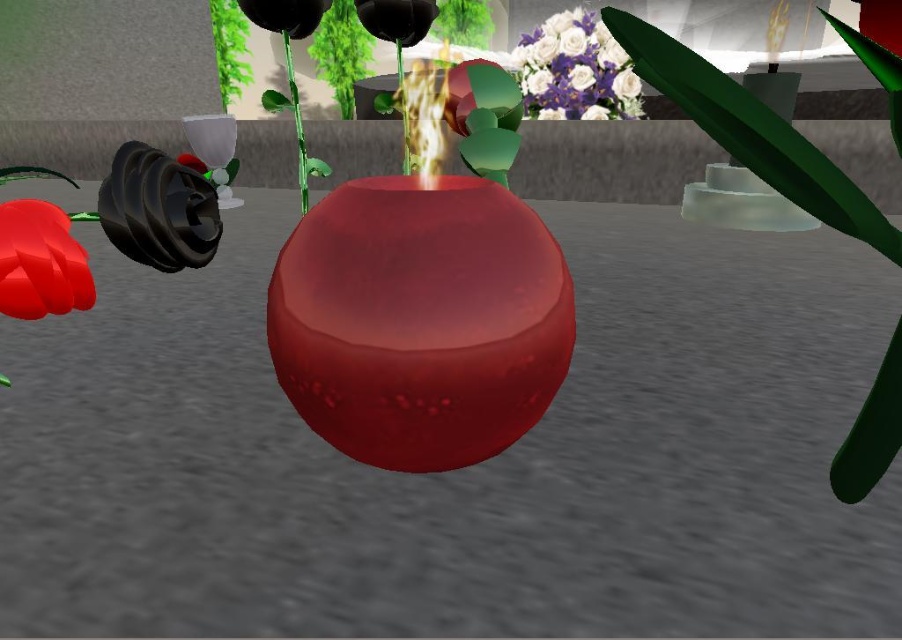
Which is behind, point (537, 102) or point (48, 202)?

Positioned behind is point (537, 102).

Is glossy ceramic vase at upper center to the right of matte red flower at lower left from the viewer's perspective?

Correct, you'll find glossy ceramic vase at upper center to the right of matte red flower at lower left.

In the scene shown: Who is more distant from viewer, (615,74) or (63,244)?

Positioned behind is point (615,74).

The height and width of the screenshot is (640, 902). I want to click on glossy ceramic vase at upper center, so click(x=575, y=70).